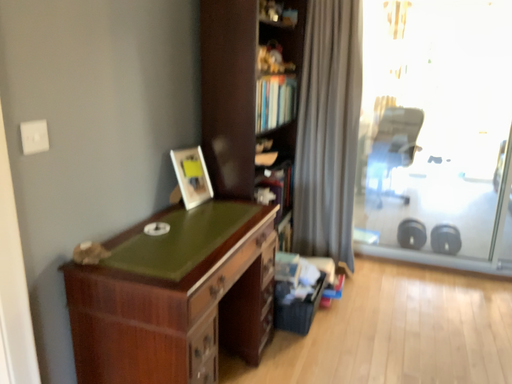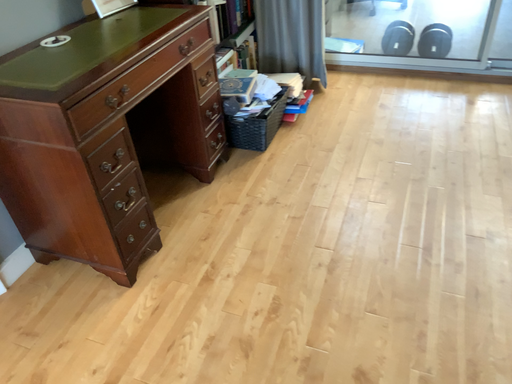
Question: How did the camera likely rotate when shooting the video?

Choices:
 (A) rotated upward
 (B) rotated downward

Answer: (B)